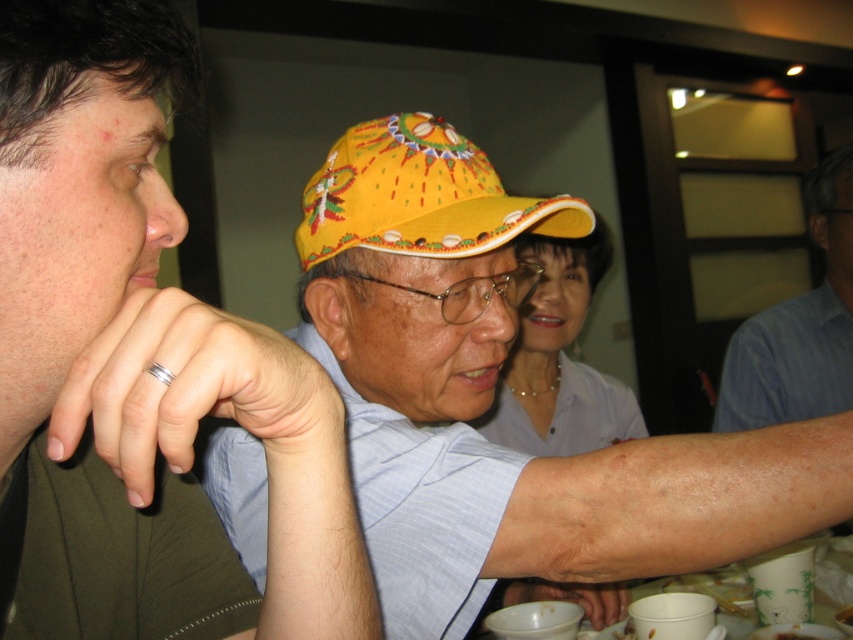
Who is more forward, (567, 314) or (809, 179)?

Point (567, 314)

Does smooth white blouse at center have a smaller size compared to blue striped shirt at right?

No, smooth white blouse at center is not smaller than blue striped shirt at right.

Who is more distant from viewer, (573, 426) or (804, 378)?

The point (804, 378) is behind.

In order to click on smooth white blouse at center in this screenshot , I will do (x=560, y=358).

How distant is yellow fabric baseball hat at center from blue striped shirt at right?

yellow fabric baseball hat at center and blue striped shirt at right are 38.92 inches apart.

Can you confirm if yellow fabric baseball hat at center is smaller than blue striped shirt at right?

Yes.

Is point (438, 202) positioned behind point (776, 352)?

No, (438, 202) is in front of (776, 352).

I want to click on yellow fabric baseball hat at center, so click(x=419, y=196).

Can you confirm if yellow fabric cap at upper center is shorter than yellow fabric baseball hat at center?

No, yellow fabric cap at upper center is not shorter than yellow fabric baseball hat at center.

Who is taller, yellow fabric cap at upper center or yellow fabric baseball hat at center?

yellow fabric cap at upper center is taller.

Does point (119, 337) come behind point (321, 170)?

No.

Image resolution: width=853 pixels, height=640 pixels. I want to click on yellow fabric cap at upper center, so click(x=138, y=369).